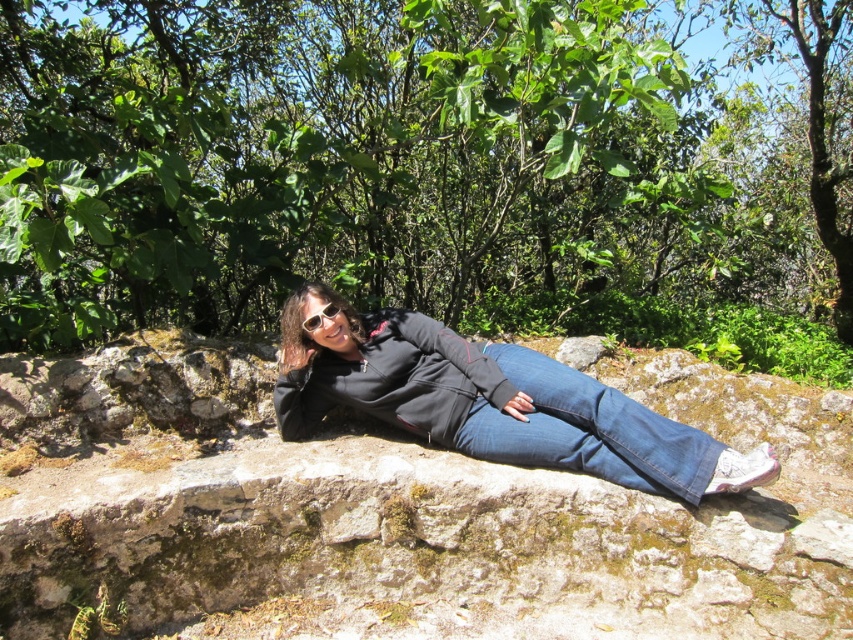
Question: Which point is farther to the camera?

Choices:
 (A) (334, 314)
 (B) (285, 253)

Answer: (B)

Question: Estimate the real-world distances between objects in this image. Which object is closer to the black matte jacket at center?

Choices:
 (A) sunglasses at center
 (B) denim at center

Answer: (B)

Question: In this image, where is green leafy tree at upper center located relative to black matte jacket at center?

Choices:
 (A) below
 (B) above

Answer: (B)

Question: Which of the following is the closest to the observer?

Choices:
 (A) black matte jacket at center
 (B) green leafy tree at upper center

Answer: (A)

Question: In this image, where is denim at center located relative to sunglasses at center?

Choices:
 (A) above
 (B) below

Answer: (B)

Question: Where is green leafy tree at upper center located in relation to black matte jacket at center in the image?

Choices:
 (A) above
 (B) below

Answer: (A)